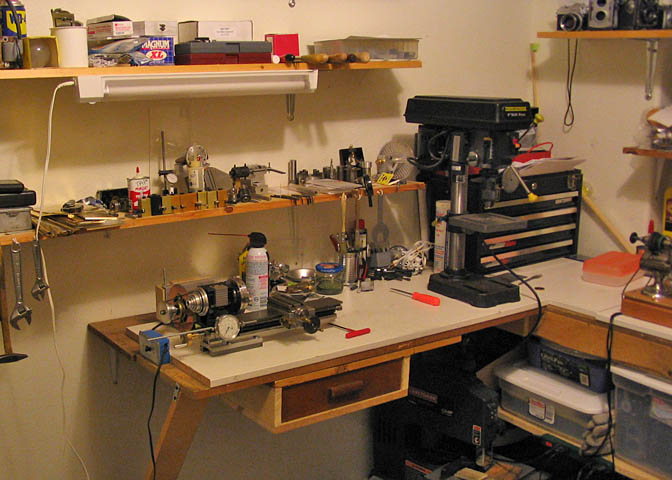
This screenshot has width=672, height=480. Find the location of `white cord`. white cord is located at coordinates (48, 146).